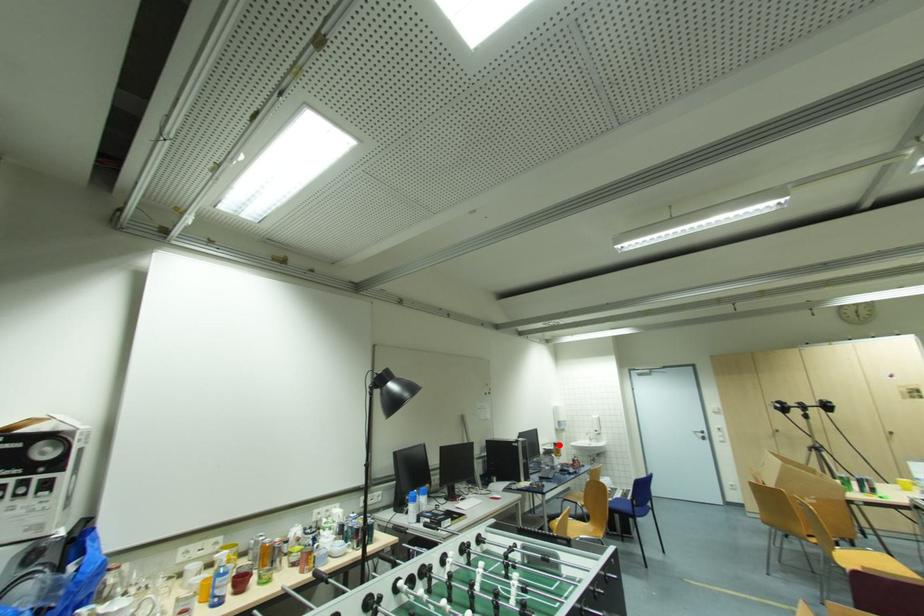
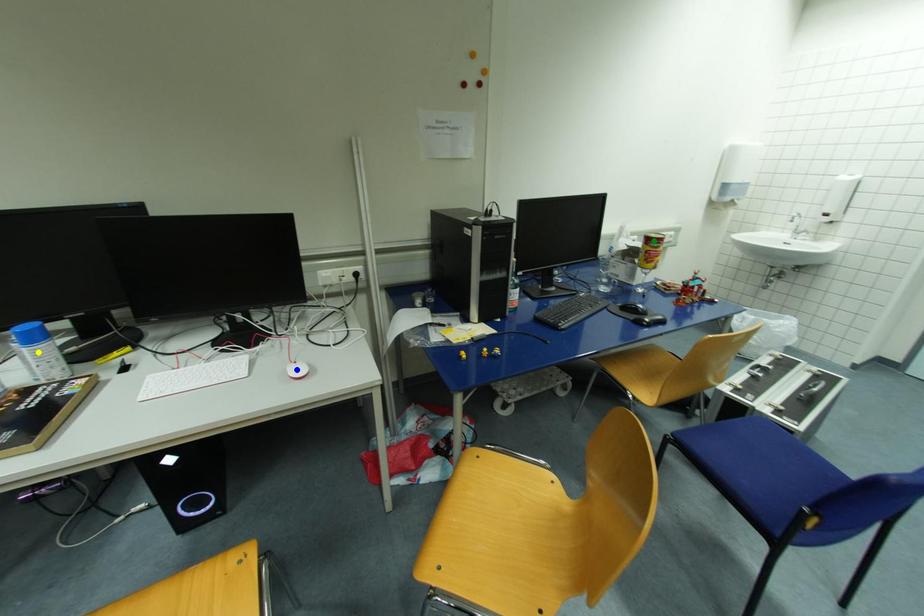
Question: I am providing you with two images of the same scene from different viewpoints. A red point is marked on the first image. You are given multiple points on the second image. Can you choose the point in image 2 that corresponds to the point in image 1?

Choices:
 (A) yellow point
 (B) blue point
 (C) green point

Answer: (C)